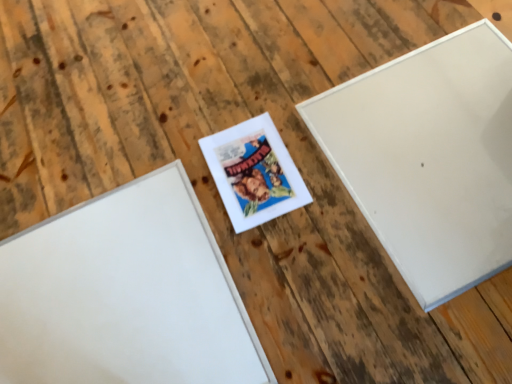
Locate an element on the screen. The image size is (512, 384). vacant space in between matte white picture frame at center, positioned as the second picture frame in right-to-left order, and white matte picture frame at upper right, the first picture frame positioned from the right is located at coordinates (318, 208).